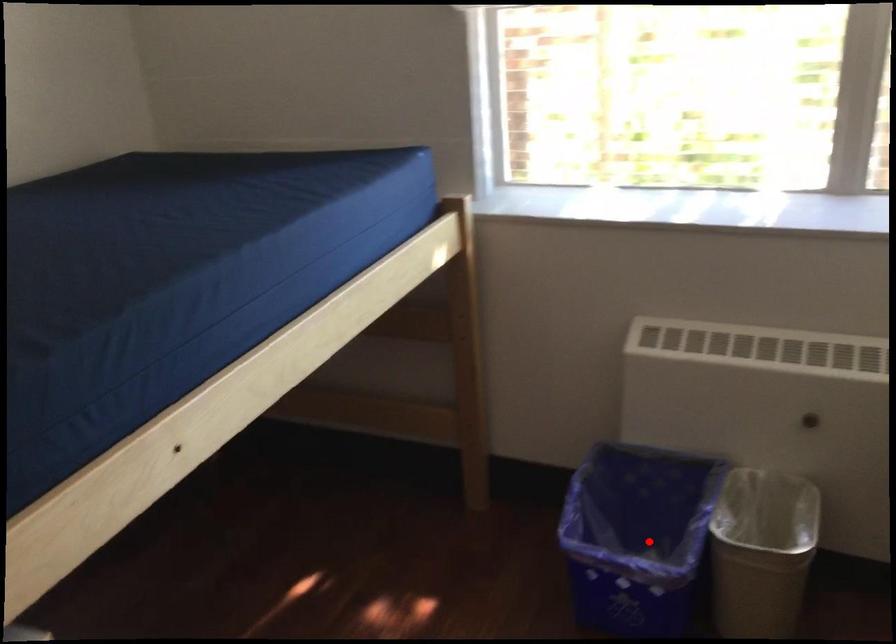
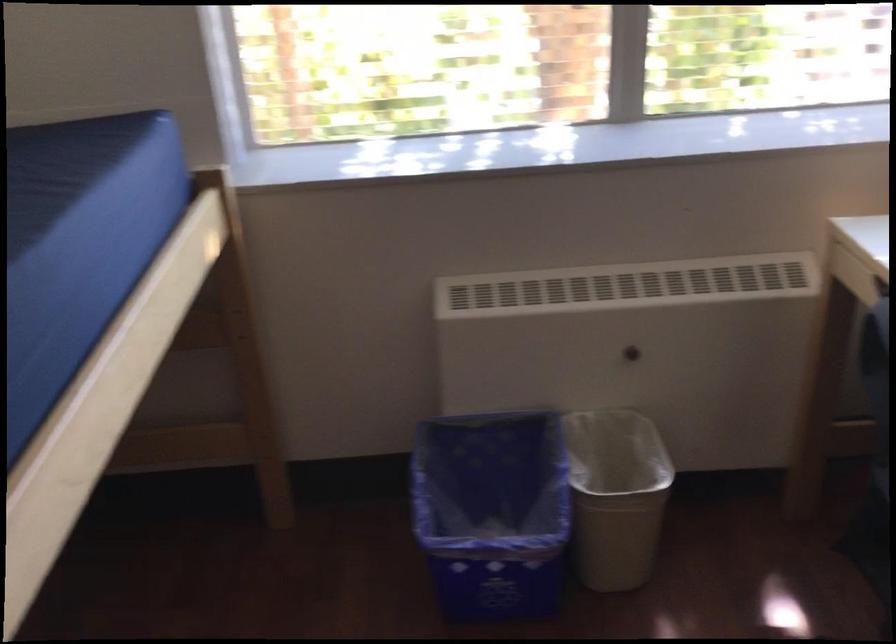
In the second image, find the point that corresponds to the highlighted location in the first image.

(492, 512)